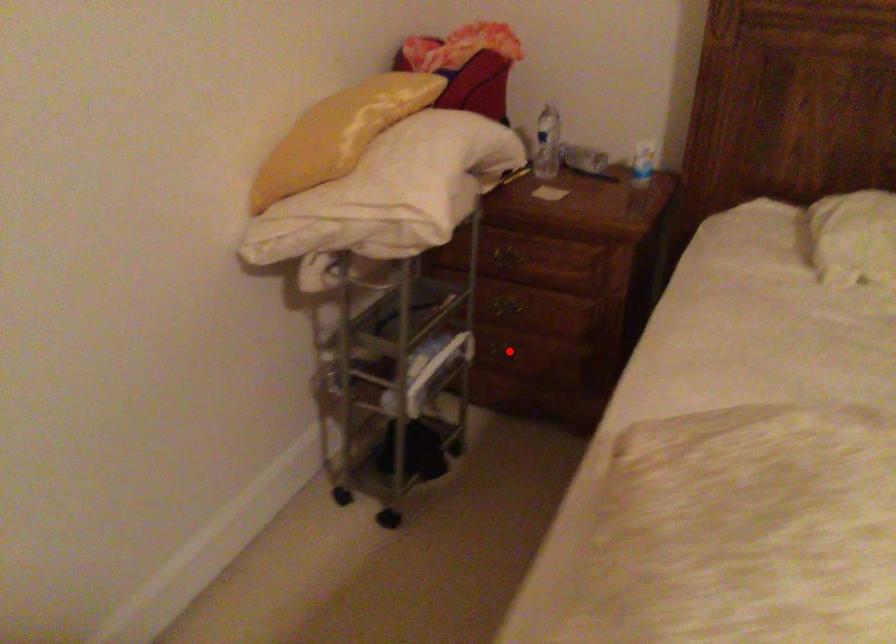
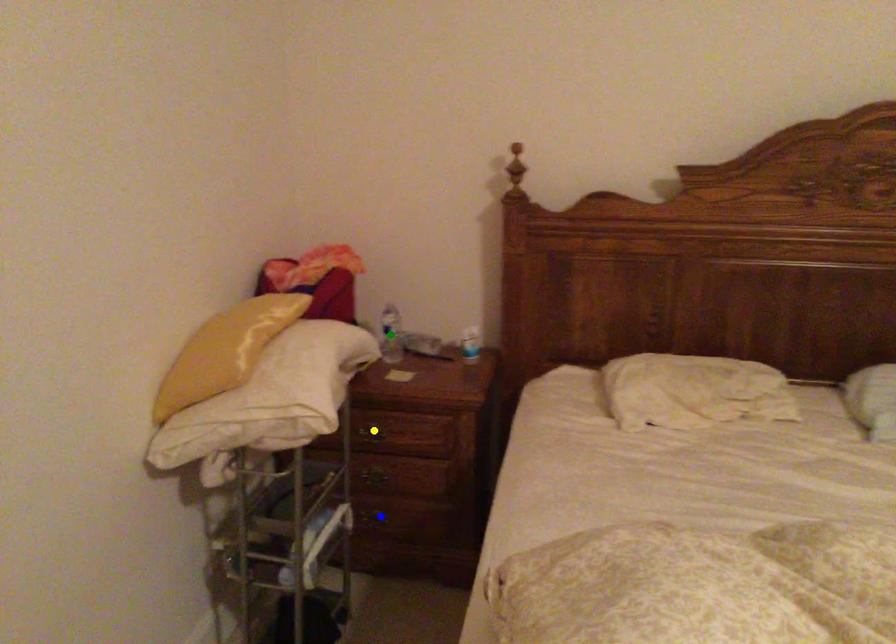
Question: I am providing you with two images of the same scene from different viewpoints. A red point is marked on the first image. You are given multiple points on the second image. In image 2, which mark is for the same physical point as the one in image 1?

Choices:
 (A) green point
 (B) yellow point
 (C) blue point

Answer: (C)